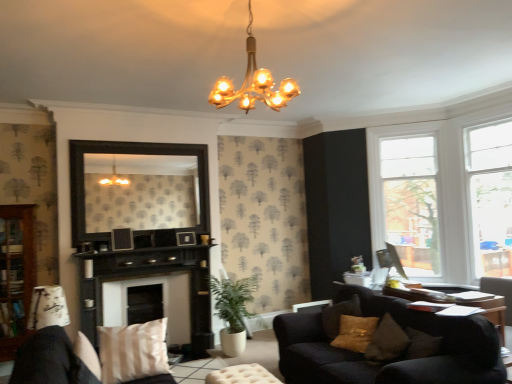
In order to face tufted leather footrest at lower center, should I rotate leftwards or rightwards?

Rotate left and turn 1.131 degrees.

Locate an element on the screen. tufted leather footrest at lower center is located at coordinates (242, 375).

What do you see at coordinates (16, 274) in the screenshot?
I see `wooden bookshelf at left` at bounding box center [16, 274].

The image size is (512, 384). Describe the element at coordinates (490, 196) in the screenshot. I see `white wood window frame at upper right, which ranks as the 1th window frame in front-to-back order` at that location.

Describe the element at coordinates (392, 362) in the screenshot. I see `velvet dark blue couch at lower right` at that location.

This screenshot has height=384, width=512. What do you see at coordinates (133, 351) in the screenshot? I see `beige fabric pillow at lower left` at bounding box center [133, 351].

At what (x,y) coordinates should I click in order to perform the action: click on tufted leather footrest at lower center. Please return your answer as a coordinate pair (x, y). Looking at the image, I should click on (242, 375).

Is tufted leather footrest at lower center facing towards green leafy plant at lower center?

No, tufted leather footrest at lower center is not aimed at green leafy plant at lower center.

Is tufted leather footrest at lower center shorter than green leafy plant at lower center?

Indeed, tufted leather footrest at lower center has a lesser height compared to green leafy plant at lower center.

From the image's perspective, is tufted leather footrest at lower center beneath green leafy plant at lower center?

Yes, from the image's perspective, tufted leather footrest at lower center is below green leafy plant at lower center.

Which object is positioned more to the left, tufted leather footrest at lower center or green leafy plant at lower center?

Positioned to the left is green leafy plant at lower center.

Can you confirm if beige fabric pillow at lower left is wider than wooden bookshelf at left?

Correct, the width of beige fabric pillow at lower left exceeds that of wooden bookshelf at left.

How distant is beige fabric pillow at lower left from wooden bookshelf at left?

A distance of 3.57 feet exists between beige fabric pillow at lower left and wooden bookshelf at left.

Is beige fabric pillow at lower left bigger than wooden bookshelf at left?

No, beige fabric pillow at lower left is not bigger than wooden bookshelf at left.

From a real-world perspective, which is physically above, velvet dark blue couch at lower right or white wood window frame at upper right, which appears as the second window frame when viewed from the front?

white wood window frame at upper right, which appears as the second window frame when viewed from the front.

How different are the orientations of velvet dark blue couch at lower right and white wood window frame at upper right, the 1th window frame from the back, in degrees?

43.7 degrees separate the facing orientations of velvet dark blue couch at lower right and white wood window frame at upper right, the 1th window frame from the back.

From the image's perspective, between velvet dark blue couch at lower right and white wood window frame at upper right, which appears as the second window frame when viewed from the front, which one is located above?

From the image's view, white wood window frame at upper right, which appears as the second window frame when viewed from the front, is above.

In the scene shown: From their relative heights in the image, would you say velvet dark blue couch at lower right is taller or shorter than white wood window frame at upper right, which appears as the second window frame when viewed from the front?

In the image, velvet dark blue couch at lower right appears to be shorter than white wood window frame at upper right, which appears as the second window frame when viewed from the front.

Is white wood window frame at upper right, which appears as the second window frame when viewed from the front, directly adjacent to gold metallic chandelier at upper center, the 1th lamp in the right-to-left sequence?

No, white wood window frame at upper right, which appears as the second window frame when viewed from the front, is not touching gold metallic chandelier at upper center, the 1th lamp in the right-to-left sequence.

Consider the image. Considering the sizes of objects white wood window frame at upper right, which appears as the second window frame when viewed from the front, and gold metallic chandelier at upper center, which appears as the 2th lamp when viewed from the left, in the image provided, who is taller, white wood window frame at upper right, which appears as the second window frame when viewed from the front, or gold metallic chandelier at upper center, which appears as the 2th lamp when viewed from the left,?

With more height is white wood window frame at upper right, which appears as the second window frame when viewed from the front.

From the picture: Could you tell me if white wood window frame at upper right, which is counted as the second window frame, starting from the right, is turned towards gold metallic chandelier at upper center, acting as the 1th lamp starting from the top?

Yes.

Is white wood window frame at upper right, which appears as the second window frame when viewed from the front, further to the viewer compared to gold metallic chandelier at upper center, placed as the 1th lamp when sorted from front to back?

Yes, the depth of white wood window frame at upper right, which appears as the second window frame when viewed from the front, is greater than that of gold metallic chandelier at upper center, placed as the 1th lamp when sorted from front to back.

From a real-world perspective, which is physically above, matte white lampshade at lower left, positioned as the 2th lamp in front-to-back order, or black wood fireplace at center, the 1th fireplace positioned from the front?

matte white lampshade at lower left, positioned as the 2th lamp in front-to-back order, from a real-world perspective.

Based on their positions, is matte white lampshade at lower left, which appears as the 1th lamp when ordered from the bottom, located to the left or right of black wood fireplace at center, the 1th fireplace positioned from the front?

Clearly, matte white lampshade at lower left, which appears as the 1th lamp when ordered from the bottom, is on the left of black wood fireplace at center, the 1th fireplace positioned from the front, in the image.

Does matte white lampshade at lower left, which appears as the first lamp when viewed from the back, have a lesser height compared to black wood fireplace at center, the 1th fireplace positioned from the front?

Yes.

Are matte white lampshade at lower left, positioned as the 2th lamp in front-to-back order, and black wood fireplace at center, the second fireplace from the back, beside each other?

matte white lampshade at lower left, positioned as the 2th lamp in front-to-back order, is not next to black wood fireplace at center, the second fireplace from the back, and they're not touching.

Which object is wider, matte black picture frame at center, the second picture frame positioned from the left, or matte white lampshade at lower left, which appears as the first lamp when viewed from the back?

matte white lampshade at lower left, which appears as the first lamp when viewed from the back.

Can you confirm if matte black picture frame at center, which appears as the 1th picture frame when viewed from the right, is shorter than matte white lampshade at lower left, the 2th lamp from the right?

Correct, matte black picture frame at center, which appears as the 1th picture frame when viewed from the right, is not as tall as matte white lampshade at lower left, the 2th lamp from the right.

Considering the positions of objects matte black picture frame at center, which ranks as the first picture frame in back-to-front order, and matte white lampshade at lower left, positioned as the 2th lamp in front-to-back order, in the image provided, who is more to the left, matte black picture frame at center, which ranks as the first picture frame in back-to-front order, or matte white lampshade at lower left, positioned as the 2th lamp in front-to-back order,?

matte white lampshade at lower left, positioned as the 2th lamp in front-to-back order.

At what (x,y) coordinates should I click in order to perform the action: click on cabinetry above the white painted wood fireplace at center, the second fireplace positioned from the front (from the image's perspective). Please return your answer as a coordinate pair (x, y). The width and height of the screenshot is (512, 384). Looking at the image, I should click on (16, 274).

Is white painted wood fireplace at center, the second fireplace positioned from the front, located outside wooden bookshelf at left?

Absolutely, white painted wood fireplace at center, the second fireplace positioned from the front, is external to wooden bookshelf at left.

Does white painted wood fireplace at center, the second fireplace positioned from the front, have a larger size compared to wooden bookshelf at left?

Yes.

From a real-world perspective, is white painted wood fireplace at center, the second fireplace positioned from the front, positioned over wooden bookshelf at left based on gravity?

Incorrect, from a real-world perspective, white painted wood fireplace at center, the second fireplace positioned from the front, is lower than wooden bookshelf at left.

The height and width of the screenshot is (384, 512). Find the location of `footrest below the green leafy plant at lower center (from a real-world perspective)`. footrest below the green leafy plant at lower center (from a real-world perspective) is located at coordinates (242, 375).

You are a GUI agent. You are given a task and a screenshot of the screen. Output one action in this format:
    pyautogui.click(x=<x>, y=<y>)
    Task: Click on the pillow in front of the wooden bookshelf at left
    Image resolution: width=512 pixels, height=384 pixels.
    Given the screenshot: What is the action you would take?
    pyautogui.click(x=133, y=351)

Based on their spatial positions, is matte black picture frame at upper center, the first picture frame positioned from the front, or tufted leather footrest at lower center further from white wood window frame at upper right, which appears as the second window frame when viewed from the front?

Based on the image, matte black picture frame at upper center, the first picture frame positioned from the front, appears to be further to white wood window frame at upper right, which appears as the second window frame when viewed from the front.

Estimate the real-world distances between objects in this image. Which object is further from green leafy plant at lower center, matte black picture frame at center, which appears as the 1th picture frame when viewed from the right, or matte white lampshade at lower left, the 2th lamp from the right?

matte white lampshade at lower left, the 2th lamp from the right, is further to green leafy plant at lower center.

Estimate the real-world distances between objects in this image. Which object is closer to white painted wood fireplace at center, the second fireplace positioned from the front, matte black picture frame at upper center, the first picture frame positioned from the front, or black wood fireplace at center, the second fireplace from the back?

Among the two, black wood fireplace at center, the second fireplace from the back, is located nearer to white painted wood fireplace at center, the second fireplace positioned from the front.

Which object lies further to the anchor point white wood window frame at upper right, the first window frame when ordered from left to right, wooden bookshelf at left or matte black picture frame at upper center, positioned as the first picture frame in left-to-right order?

wooden bookshelf at left lies further to white wood window frame at upper right, the first window frame when ordered from left to right, than the other object.

Considering their positions, is wooden bookshelf at left positioned further to matte black picture frame at center, the second picture frame positioned from the left, than tufted leather footrest at lower center?

Based on the image, tufted leather footrest at lower center appears to be further to matte black picture frame at center, the second picture frame positioned from the left.

Estimate the real-world distances between objects in this image. Which object is further from green leafy plant at lower center, velvet dark blue couch at lower right or matte black picture frame at center, which appears as the 1th picture frame when viewed from the right?

Based on the image, velvet dark blue couch at lower right appears to be further to green leafy plant at lower center.

Based on the photo, when comparing their distances from white wood window frame at upper right, the 1th window frame viewed from the right, does green leafy plant at lower center or beige fabric pillow at lower left seem closer?

The object closer to white wood window frame at upper right, the 1th window frame viewed from the right, is green leafy plant at lower center.

Looking at the image, which one is located closer to matte white lampshade at lower left, which is the 2th lamp from top to bottom, tufted leather footrest at lower center or velvet dark blue couch at lower right?

Based on the image, tufted leather footrest at lower center appears to be nearer to matte white lampshade at lower left, which is the 2th lamp from top to bottom.

The image size is (512, 384). I want to click on the footrest positioned between velvet dark blue couch at lower right and matte black picture frame at center, which appears as the 2th picture frame when viewed from the front, from near to far, so click(242, 375).

Locate an element on the screen. The image size is (512, 384). mirror between wooden bookshelf at left and tufted leather footrest at lower center in the horizontal direction is located at coordinates (140, 192).

Find the location of `cabinetry located between gold metallic chandelier at upper center, which appears as the 2th lamp when viewed from the left, and dark wood mirror at center in the depth direction`. cabinetry located between gold metallic chandelier at upper center, which appears as the 2th lamp when viewed from the left, and dark wood mirror at center in the depth direction is located at coordinates (16, 274).

Image resolution: width=512 pixels, height=384 pixels. In order to click on studio couch located between gold metallic chandelier at upper center, which appears as the 2th lamp when viewed from the left, and black wood fireplace at center, the 1th fireplace positioned from the front, in the depth direction in this screenshot , I will do (x=392, y=362).